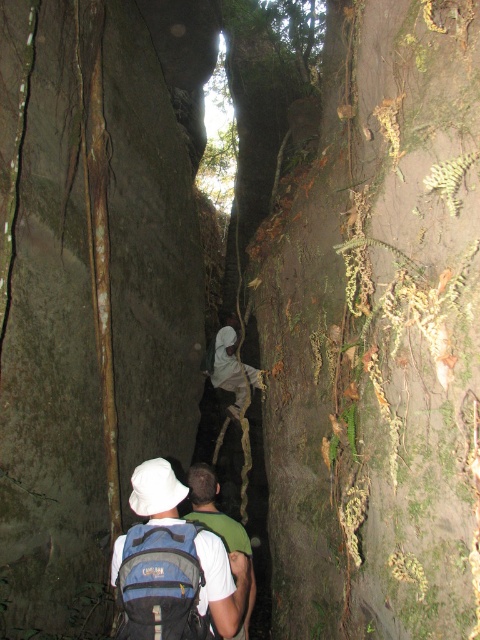
Question: From the image, what is the correct spatial relationship of blue fabric backpack at center in relation to white matte backpack at center?

Choices:
 (A) left
 (B) right

Answer: (A)

Question: Does blue fabric backpack at center have a lesser width compared to white matte backpack at center?

Choices:
 (A) yes
 (B) no

Answer: (B)

Question: Which point is closer to the camera taking this photo?

Choices:
 (A) (204, 557)
 (B) (206, 525)

Answer: (A)

Question: Which of the following is the farthest from the observer?

Choices:
 (A) (214, 513)
 (B) (199, 545)

Answer: (A)

Question: Can you confirm if blue fabric backpack at center is positioned above white matte backpack at center?

Choices:
 (A) no
 (B) yes

Answer: (B)